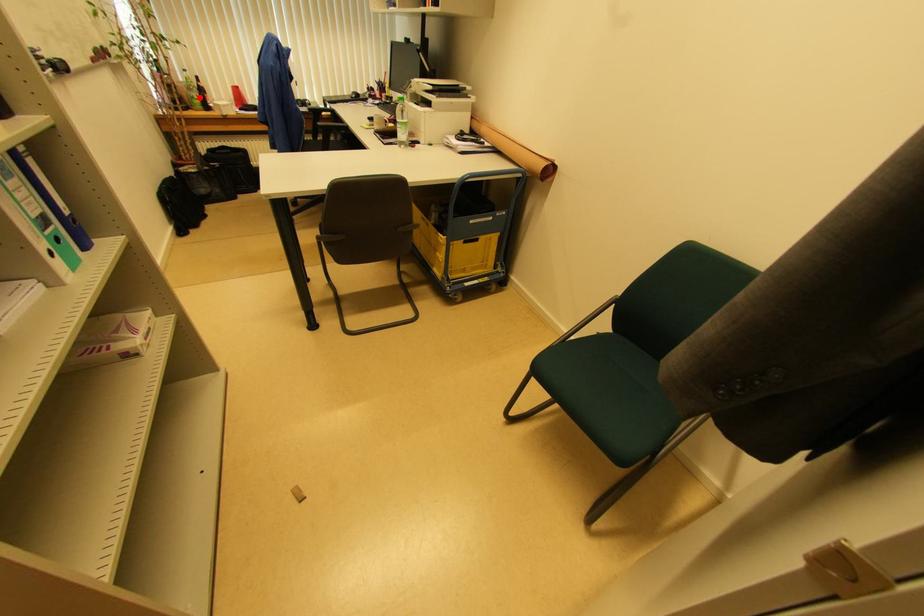
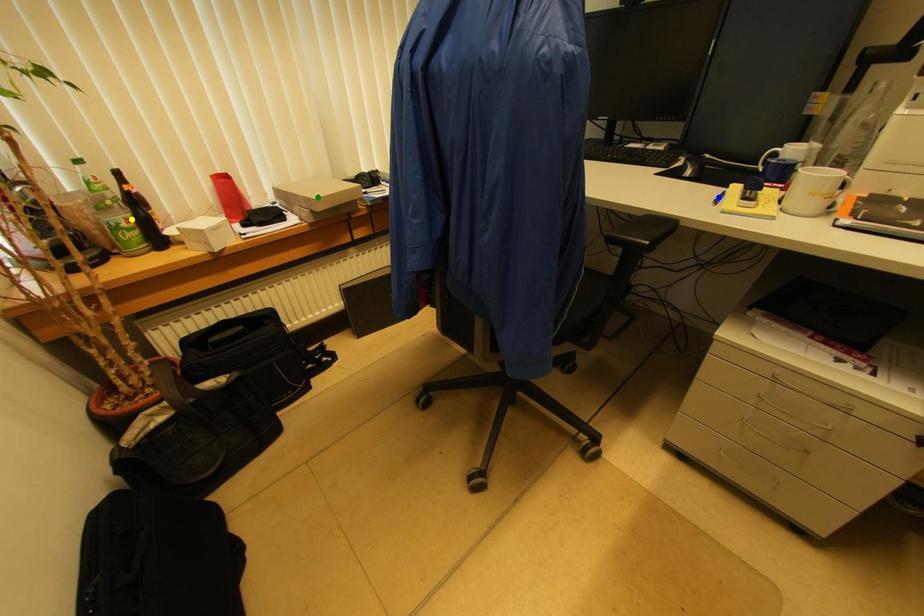
Question: I am providing you with two images of the same scene from different viewpoints. A red point is marked on the first image. You are given multiple points on the second image. Can you choose the point in image 2 that corresponds to the point in image 1?

Choices:
 (A) green point
 (B) yellow point
 (C) blue point

Answer: (B)